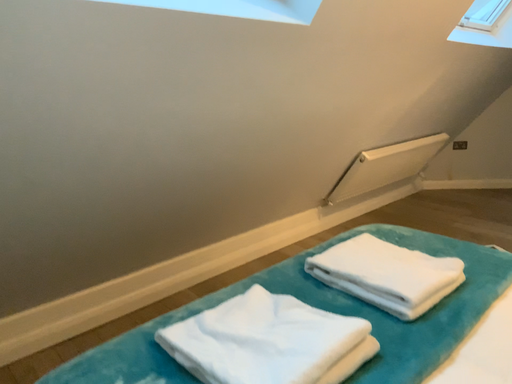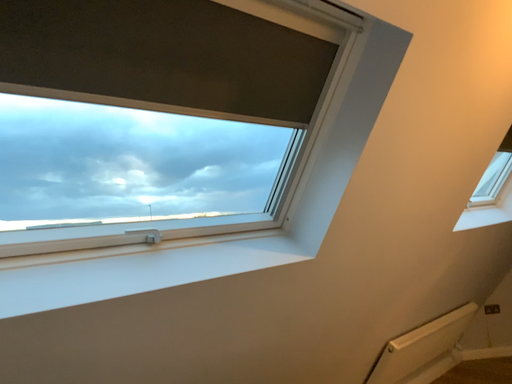
Question: Which way did the camera rotate in the video?

Choices:
 (A) rotated upward
 (B) rotated downward

Answer: (A)